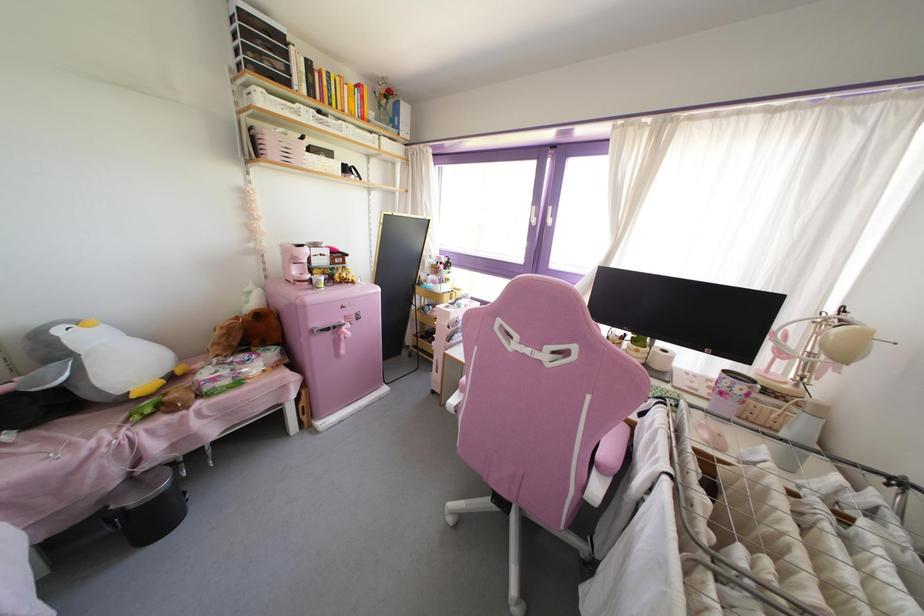
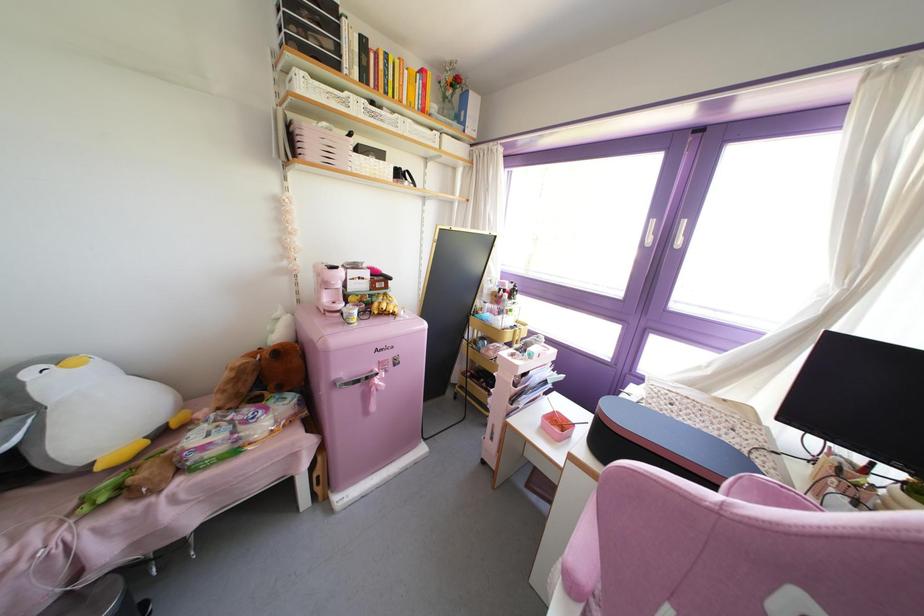
In the second image, find the point that corresponds to pixel 349 323 in the first image.

(385, 371)